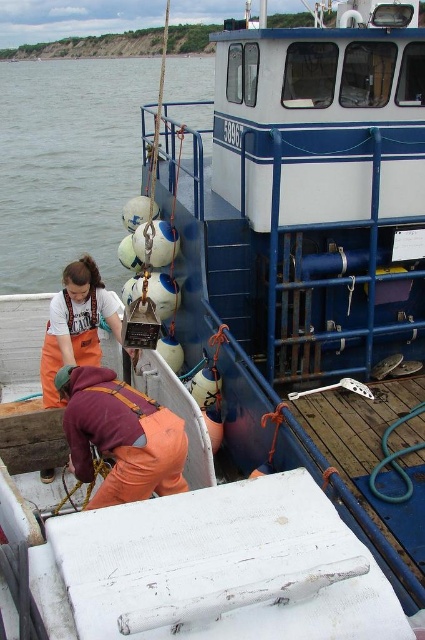
Question: Is white matte water at left bigger than orange fabric at lower center?

Choices:
 (A) no
 (B) yes

Answer: (B)

Question: Which point is farther from the camera taking this photo?

Choices:
 (A) (90, 467)
 (B) (45, 192)

Answer: (B)

Question: From the image, what is the correct spatial relationship of white matte water at left in relation to orange fabric at lower center?

Choices:
 (A) below
 (B) above

Answer: (B)

Question: Does white matte water at left have a larger size compared to orange fabric at lower center?

Choices:
 (A) no
 (B) yes

Answer: (B)

Question: Which point is farther to the camera?

Choices:
 (A) orange fabric at lower center
 (B) white matte water at left

Answer: (B)